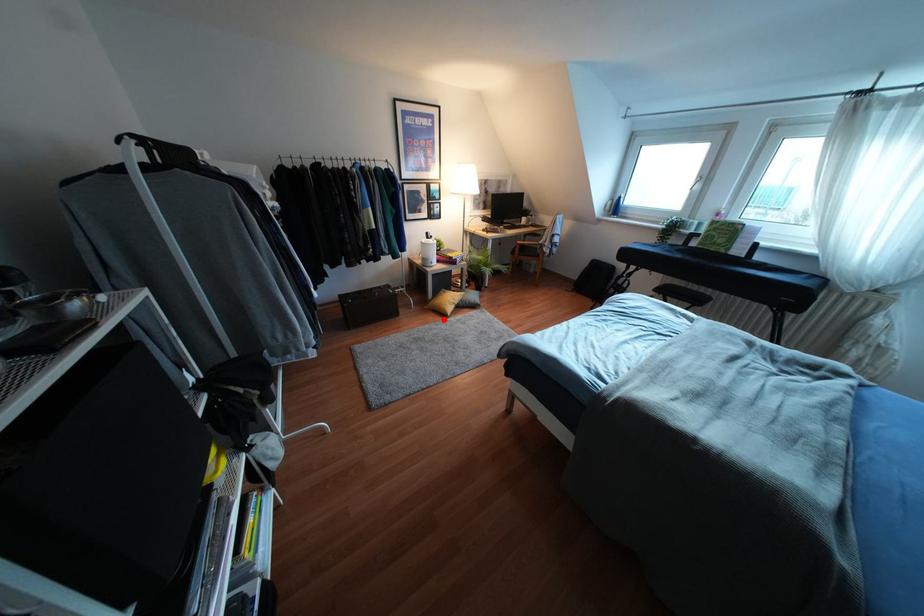
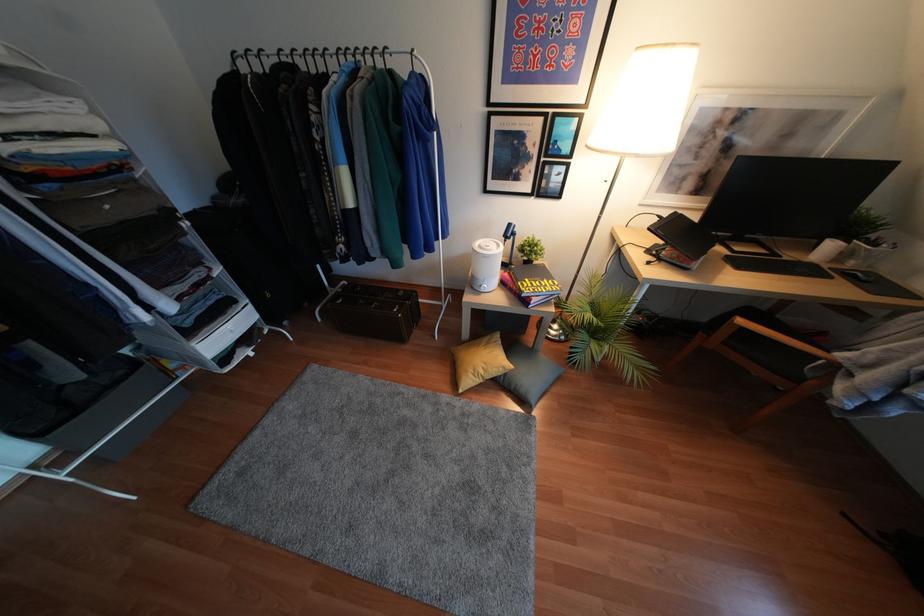
Question: I am providing you with two images of the same scene from different viewpoints. A red point is shown in image1. For the corresponding object point in image2, is it positioned nearer or farther from the camera?

Choices:
 (A) Nearer
 (B) Farther

Answer: (A)